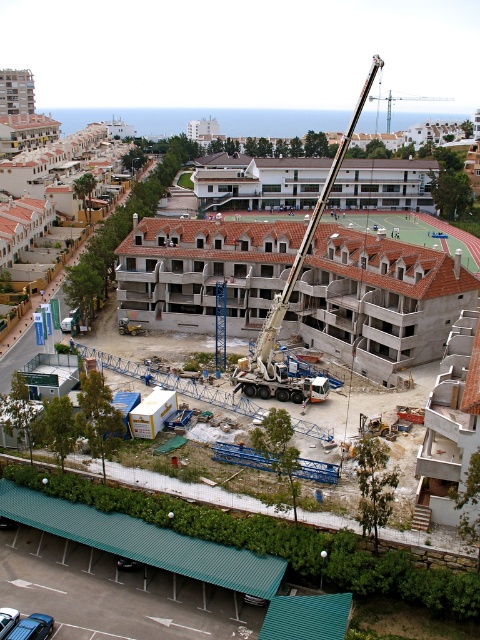
Who is positioned more to the left, white metallic crane at center or metallic silver crane at upper center?

From the viewer's perspective, white metallic crane at center appears more on the left side.

Where is `white metallic crane at center`? This screenshot has height=640, width=480. white metallic crane at center is located at coordinates (294, 282).

At what (x,y) coordinates should I click in order to perform the action: click on white metallic crane at center. Please return your answer as a coordinate pair (x, y). This screenshot has width=480, height=640. Looking at the image, I should click on (294, 282).